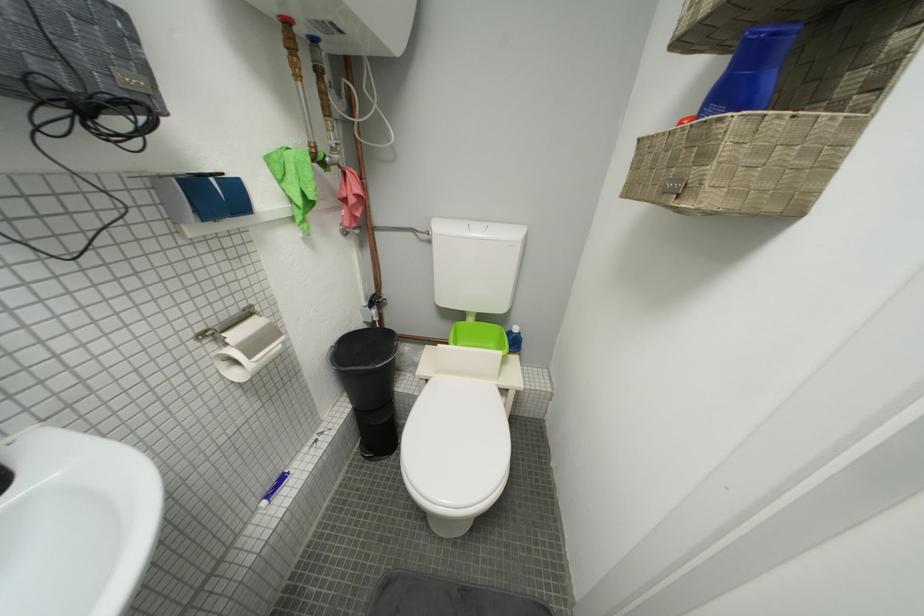
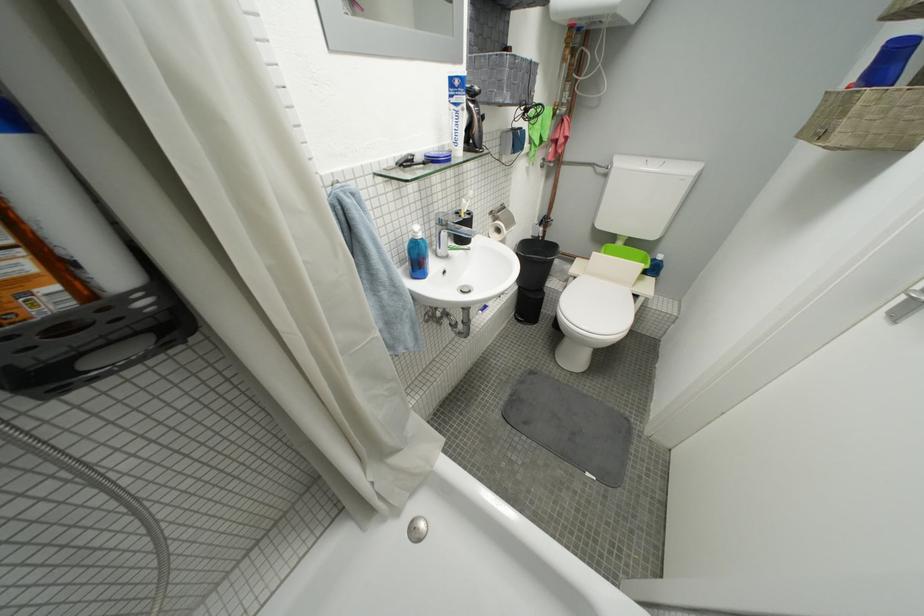
Where in the second image is the point corresponding to pixel 435 383 from the first image?

(584, 281)